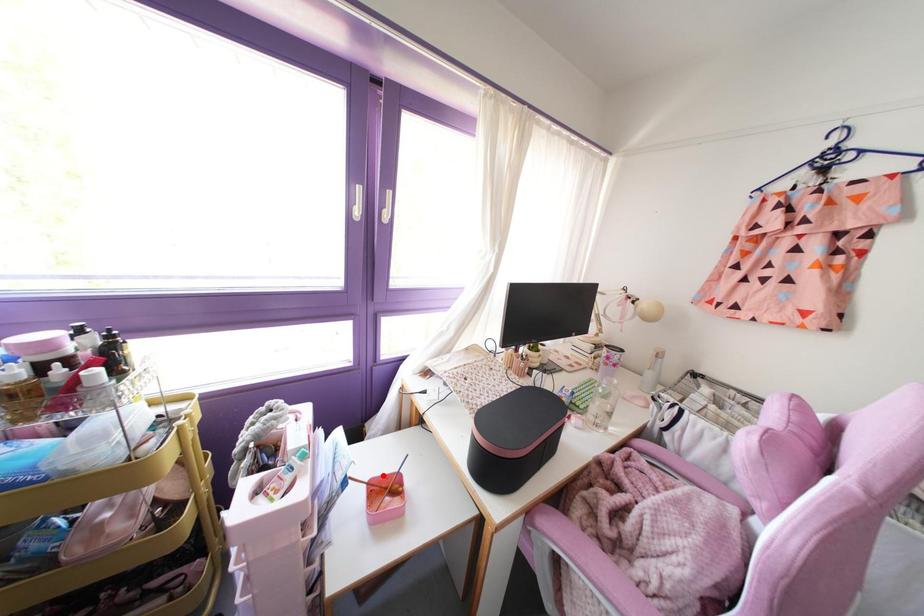
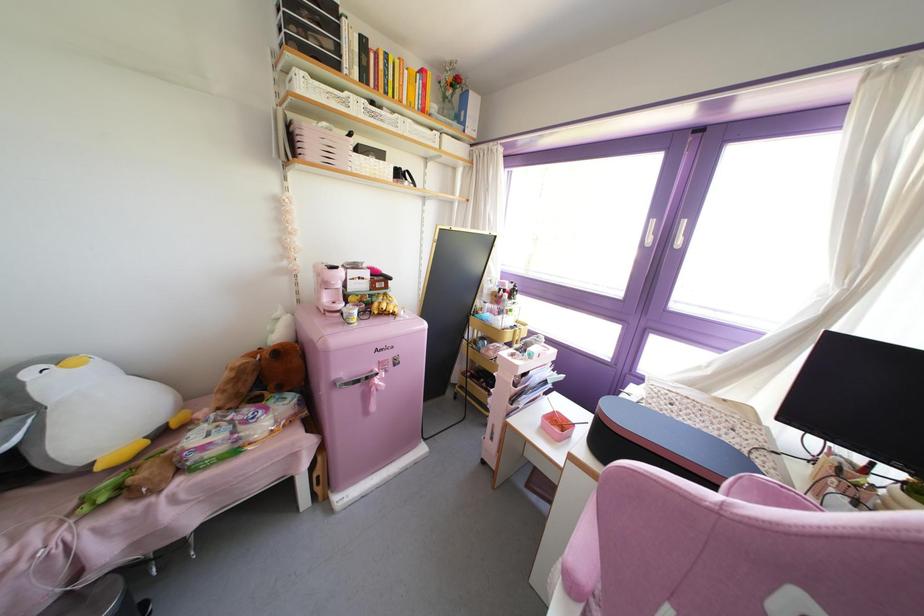
Question: I am providing you with two images of the same scene from different viewpoints. A red point is shown in image1. For the corresponding object point in image2, is it positioned nearer or farther from the camera?

Choices:
 (A) Nearer
 (B) Farther

Answer: (A)